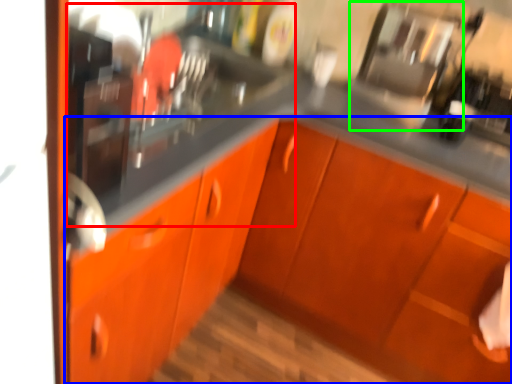
Question: Which is farther away from sink (highlighted by a red box)? cabinetry (highlighted by a blue box) or appliance (highlighted by a green box)?

Choices:
 (A) cabinetry
 (B) appliance

Answer: (B)